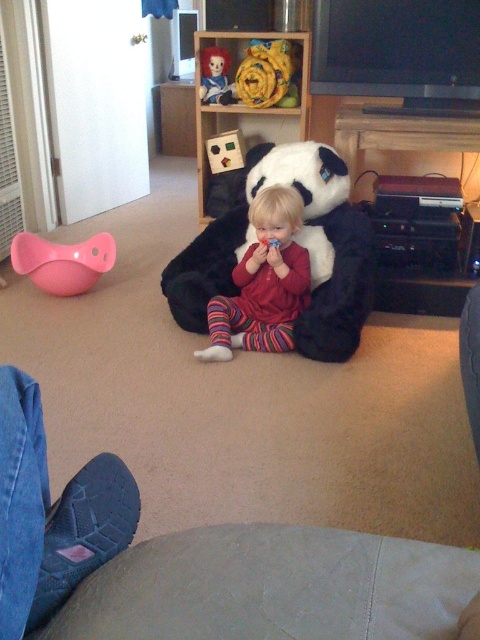
You are a parent trying to place a small toy between the soft plush panda at center and the smooth plastic doll at upper center. The toy is 10 inches long. Can the toy fit between them without overlapping either object?

The soft plush panda at center is 32.00 inches away from the smooth plastic doll at upper center. Since the toy is only 10 inches long, there is enough space between them to place the toy without overlapping either object.

You are a parent trying to find your child who is wearing striped fleece pajamas at center. You see the image and notice the soft plush panda at center. Which object is closer to you, the parent, in the image?

The soft plush panda at center is closer to the viewer than striped fleece pajamas at center, so the parent would see the soft plush panda at center first as it is nearer.

You are a parent trying to choose a bedtime storybook for your child. The storybook is 20 cm tall. You want to place it on the shelf where the soft plush panda at center and the smooth plastic doll at upper center are located. Can the storybook fit on the shelf between these two items?

The soft plush panda at center is larger in size than the smooth plastic doll at upper center. Since the storybook is 20 cm tall, it depends on the available space between them. However, without specific measurements of the shelf or the gap between the two items, it is uncertain if it will fit. Please check the actual space available.